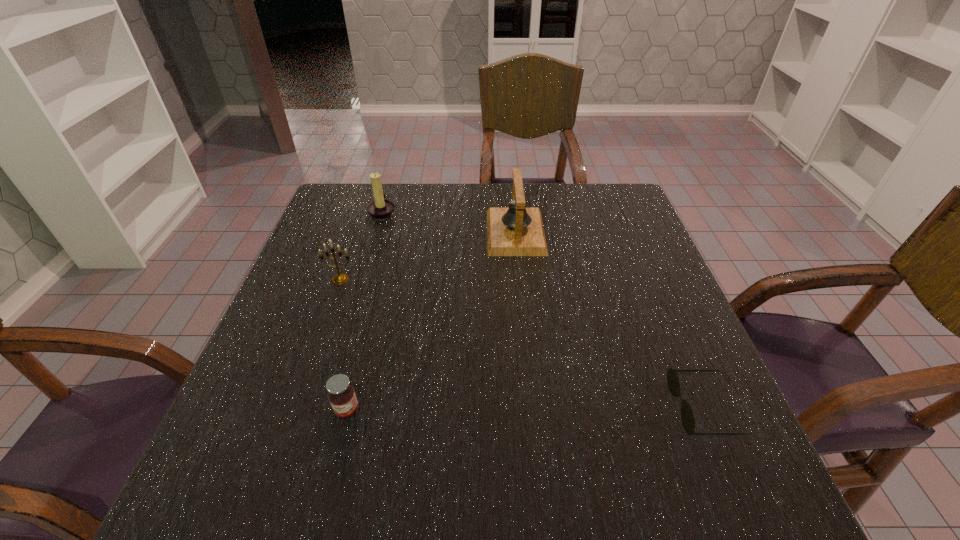
The height and width of the screenshot is (540, 960). In the image, there is a desktop. Identify the location of vacant area at the right edge. (618, 244).

This screenshot has width=960, height=540. Find the location of `free region at the far left corner of the desktop`. free region at the far left corner of the desktop is located at coordinates (344, 214).

Where is `free point at the far right corner`? The height and width of the screenshot is (540, 960). free point at the far right corner is located at coordinates (589, 192).

The width and height of the screenshot is (960, 540). What are the coordinates of `free space between the bell and the third nearest object` in the screenshot? It's located at (428, 256).

At what (x,y) coordinates should I click in order to perform the action: click on free spot between the shortest object and the farther candelabrum. Please return your answer as a coordinate pair (x, y). The image size is (960, 540). Looking at the image, I should click on (542, 310).

The width and height of the screenshot is (960, 540). Identify the location of blank region between the third farthest object and the sunglasses. (521, 344).

Find the location of a particular element. empty space between the sunglasses and the jam is located at coordinates (525, 409).

The image size is (960, 540). What are the coordinates of `vacant space that's between the second shortest object and the third nearest object` in the screenshot? It's located at (344, 345).

Where is `empty location between the bell and the sunglasses`? empty location between the bell and the sunglasses is located at coordinates (609, 320).

Locate an element on the screen. free space between the farther candelabrum and the fourth object from left to right is located at coordinates (449, 222).